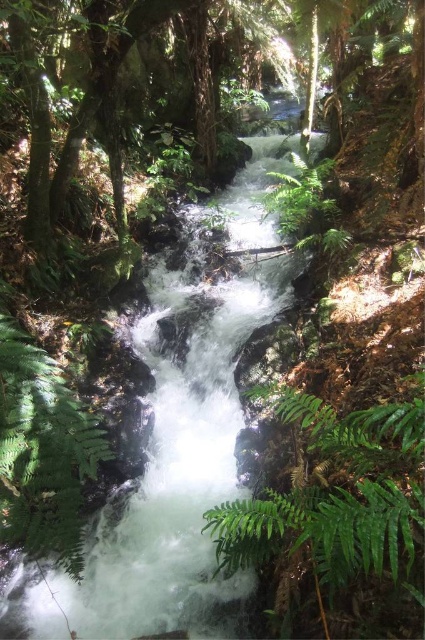
Does green leafy fern at center have a larger size compared to green fuzzy fern at lower left?

Indeed, green leafy fern at center has a larger size compared to green fuzzy fern at lower left.

Can you confirm if green leafy fern at center is thinner than green fuzzy fern at lower left?

In fact, green leafy fern at center might be wider than green fuzzy fern at lower left.

Describe the element at coordinates (337, 493) in the screenshot. I see `green leafy fern at center` at that location.

Find the location of `green leafy fern at center`. green leafy fern at center is located at coordinates (337, 493).